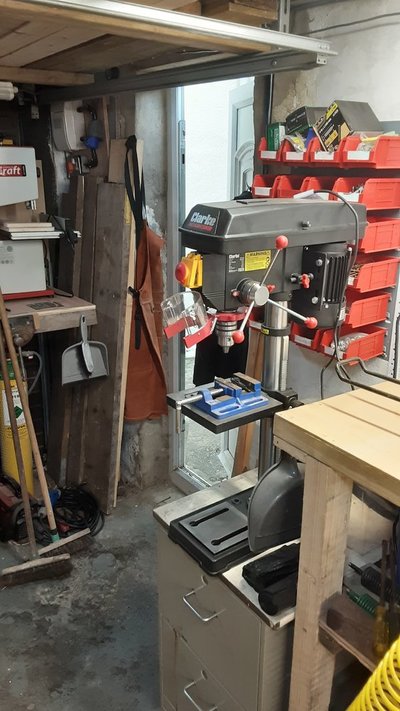
Where is `brooms`? The image size is (400, 711). brooms is located at coordinates point(44,486), point(30,537).